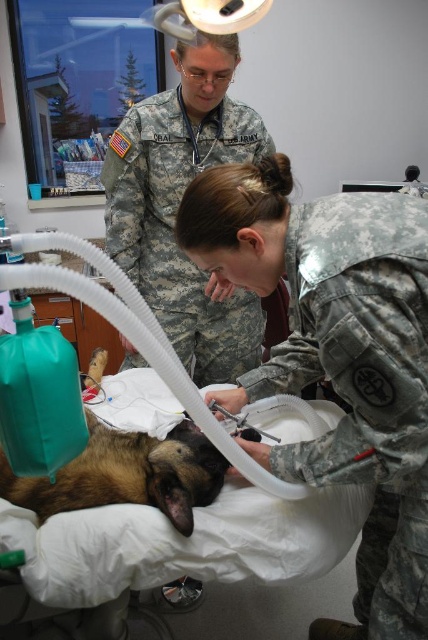
In the veterinary surgery scene, there are two people in U.S. Army uniforms. One is overseeing the procedure and has a stethoscope around their neck. The other is represented by the point at position (336,353). Which of the two people is closer to the dog?

The person in the camouflage uniform at center is closer to the dog because the point (336,353) represents their position, which is at the center of the scene where the dog is located.

You are a medical student observing the veterinary procedure. You need to note the positions of the camouflage uniform at center and the brown fur dog at center. Which one is located higher in the image?

The camouflage uniform at center is above the brown fur dog at center, so it is higher in the image.